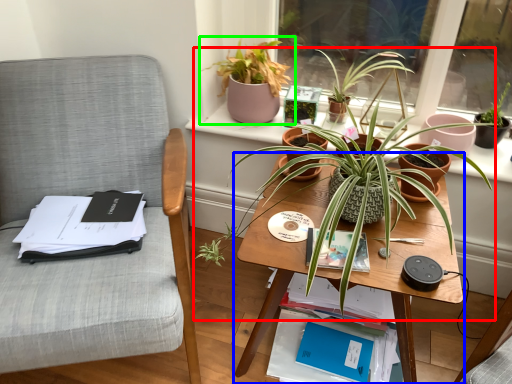
Question: Based on their relative distances, which object is farther from houseplant (highlighted by a red box)? Choose from table (highlighted by a blue box) and houseplant (highlighted by a green box).

Choices:
 (A) table
 (B) houseplant

Answer: (B)